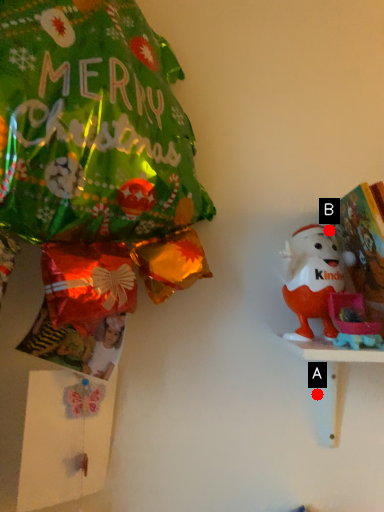
Question: Two points are circled on the image, labeled by A and B beside each circle. Which point is further to the camera?

Choices:
 (A) A is further
 (B) B is further

Answer: (A)